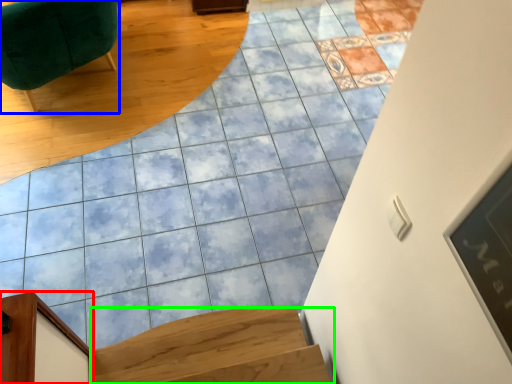
Question: Which is nearer to the furniture (highlighted by a red box)? furniture (highlighted by a blue box) or stairs (highlighted by a green box).

Choices:
 (A) furniture
 (B) stairs

Answer: (B)